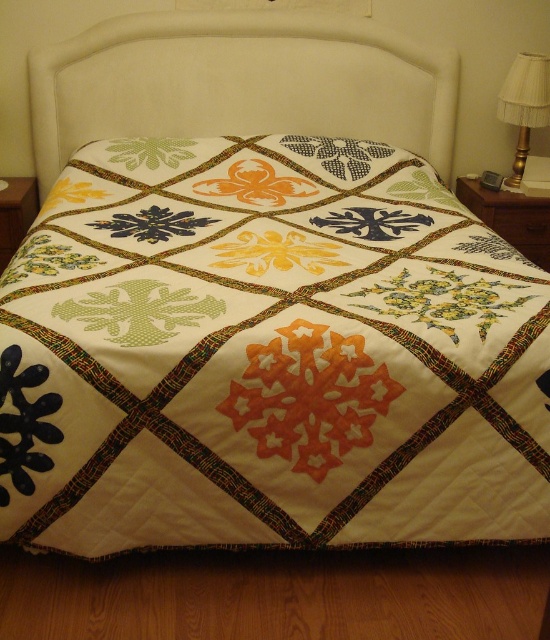
Does white quilt with colorful patterns at center have a greater width compared to white fabric headboard at upper center?

In fact, white quilt with colorful patterns at center might be narrower than white fabric headboard at upper center.

Can you confirm if white quilt with colorful patterns at center is bigger than white fabric headboard at upper center?

Yes.

Which is behind, point (343, 339) or point (338, 68)?

The point (338, 68) is more distant.

Find the location of a particular element. The image size is (550, 640). white quilt with colorful patterns at center is located at coordinates (276, 353).

Does white fabric headboard at upper center have a lesser width compared to gold metallic lampshade at right?

In fact, white fabric headboard at upper center might be wider than gold metallic lampshade at right.

Is white fabric headboard at upper center to the right of gold metallic lampshade at right from the viewer's perspective?

Incorrect, white fabric headboard at upper center is not on the right side of gold metallic lampshade at right.

This screenshot has height=640, width=550. What do you see at coordinates (240, 83) in the screenshot?
I see `white fabric headboard at upper center` at bounding box center [240, 83].

The width and height of the screenshot is (550, 640). Find the location of `white fabric headboard at upper center`. white fabric headboard at upper center is located at coordinates (240, 83).

Measure the distance between white quilt with colorful patterns at center and gold metallic lampshade at right.

white quilt with colorful patterns at center is 3.94 feet from gold metallic lampshade at right.

Is white quilt with colorful patterns at center closer to camera compared to gold metallic lampshade at right?

Yes.

Is point (63, 497) more distant than point (526, 120)?

No, it is in front of (526, 120).

Where is `white quilt with colorful patterns at center`? white quilt with colorful patterns at center is located at coordinates (276, 353).